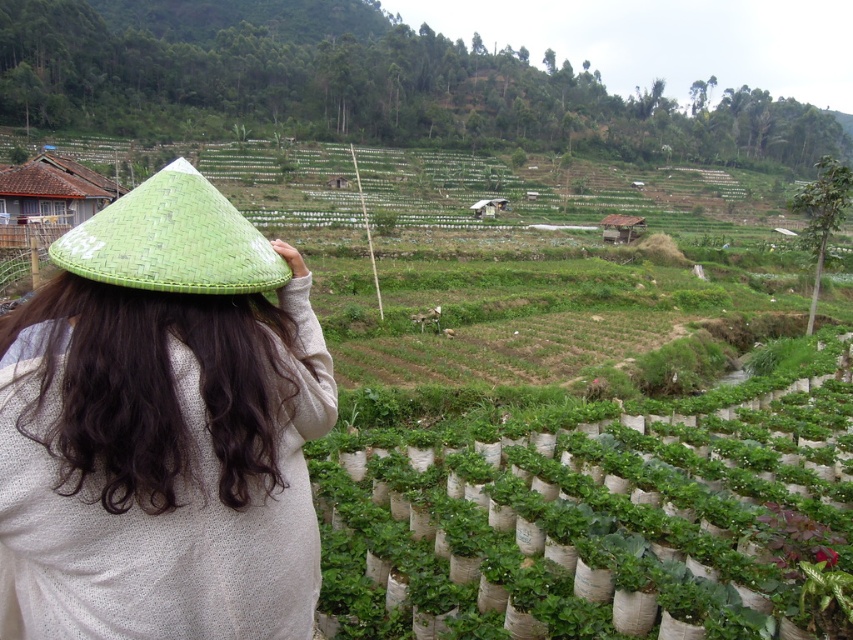
Question: Does green woven hat at upper left have a larger size compared to green woven straw hat at upper left?

Choices:
 (A) no
 (B) yes

Answer: (A)

Question: Which of the following is the farthest from the observer?

Choices:
 (A) (149, 468)
 (B) (335, 477)

Answer: (B)

Question: Does green woven hat at upper center appear under green woven straw hat at upper left?

Choices:
 (A) yes
 (B) no

Answer: (B)

Question: Can you confirm if green woven hat at upper center is positioned to the left of green woven straw hat at upper left?

Choices:
 (A) yes
 (B) no

Answer: (B)

Question: Estimate the real-world distances between objects in this image. Which object is farther from the green woven hat at upper center?

Choices:
 (A) green woven hat at upper left
 (B) green leafy plants at center
 (C) green woven straw hat at upper left

Answer: (C)

Question: Which of the following is the farthest from the observer?

Choices:
 (A) (190, 212)
 (B) (711, 522)
 (C) (294, 269)

Answer: (B)